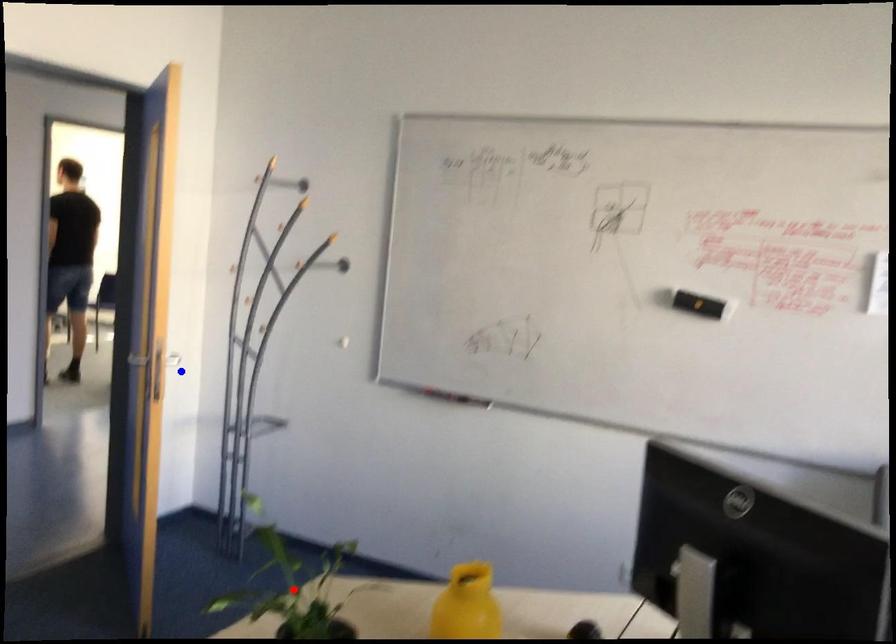
Question: Which of the two points in the image is closer to the camera?

Choices:
 (A) Blue point is closer.
 (B) Red point is closer.

Answer: (B)